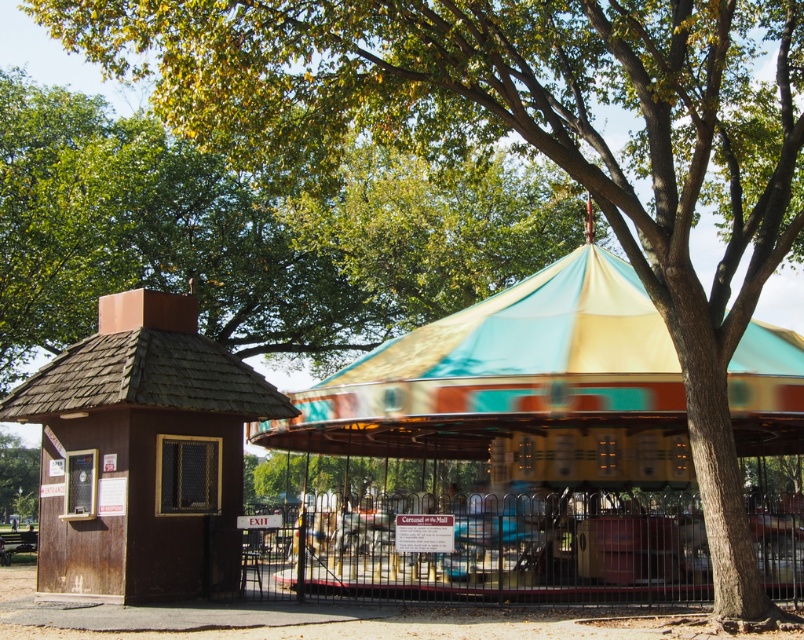
Between multicolored fabric carousel at center and brown wood gazebo at left, which one has more height?

multicolored fabric carousel at center is taller.

Who is more distant from viewer, (573, 349) or (80, 580)?

The point (573, 349) is more distant.

This screenshot has height=640, width=804. Identify the location of multicolored fabric carousel at center. (517, 387).